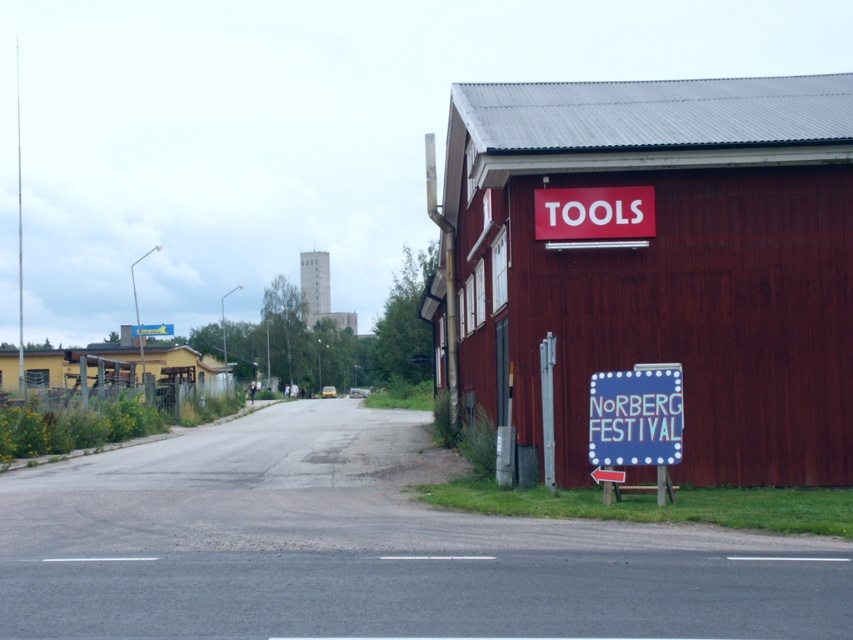
Question: Considering the real-world distances, which object is closest to the red wood barn at right?

Choices:
 (A) red matte tools at upper right
 (B) blue fabric sign at lower right

Answer: (A)

Question: Which point appears closest to the camera in this image?

Choices:
 (A) (625, 486)
 (B) (512, 144)
 (C) (602, 195)
 (D) (173, 364)

Answer: (A)

Question: Which point is farther to the camera?

Choices:
 (A) yellow wood barn at left
 (B) red wood barn at right
 (C) blue fabric sign at lower right
 (D) red matte tools at upper right

Answer: (A)

Question: Does red wood barn at right have a greater width compared to yellow wood barn at left?

Choices:
 (A) no
 (B) yes

Answer: (A)

Question: Does red wood barn at right have a lesser width compared to yellow wood barn at left?

Choices:
 (A) no
 (B) yes

Answer: (B)

Question: Is the position of yellow wood barn at left less distant than that of red matte tools at upper right?

Choices:
 (A) yes
 (B) no

Answer: (B)